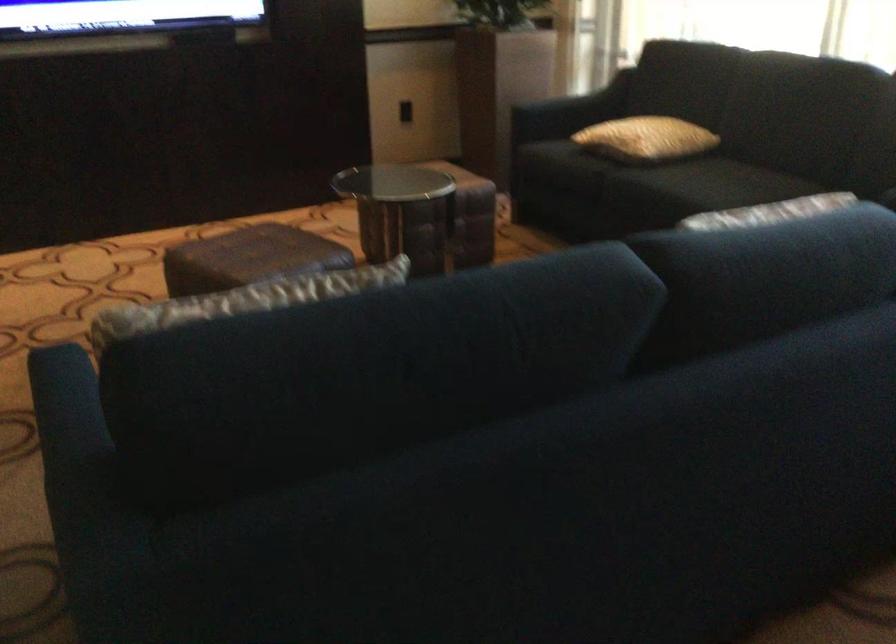
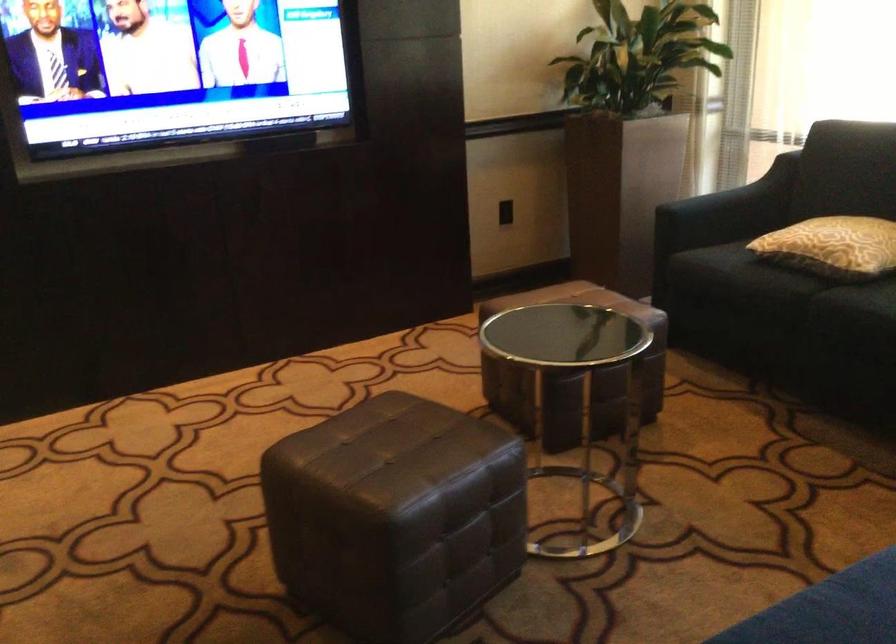
Locate, in the second image, the point that corresponds to (582,102) in the first image.

(742, 196)